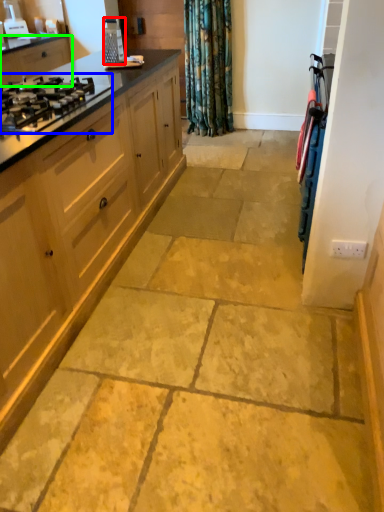
Question: Which is farther away from appliance (highlighted by a red box)? gas stove (highlighted by a blue box) or cabinetry (highlighted by a green box)?

Choices:
 (A) gas stove
 (B) cabinetry

Answer: (A)